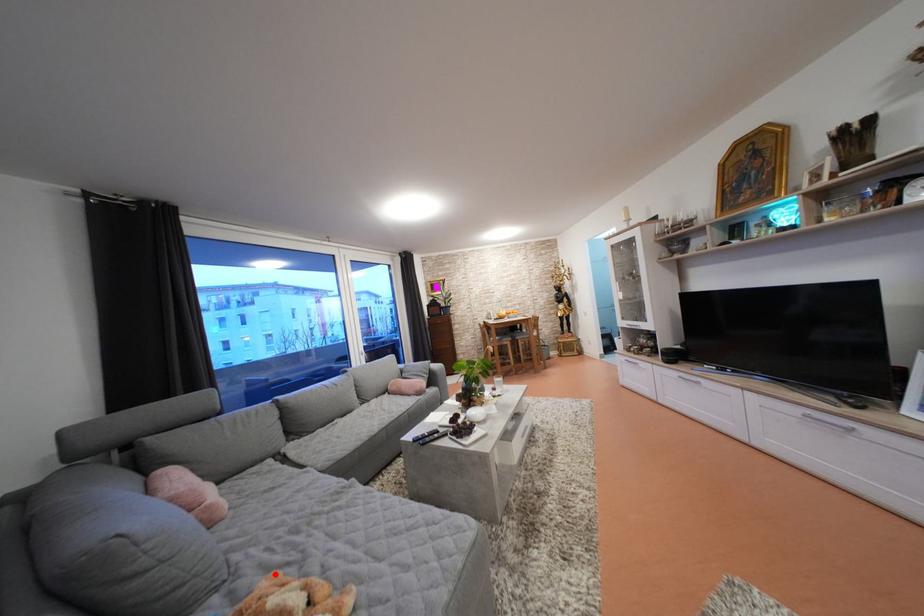
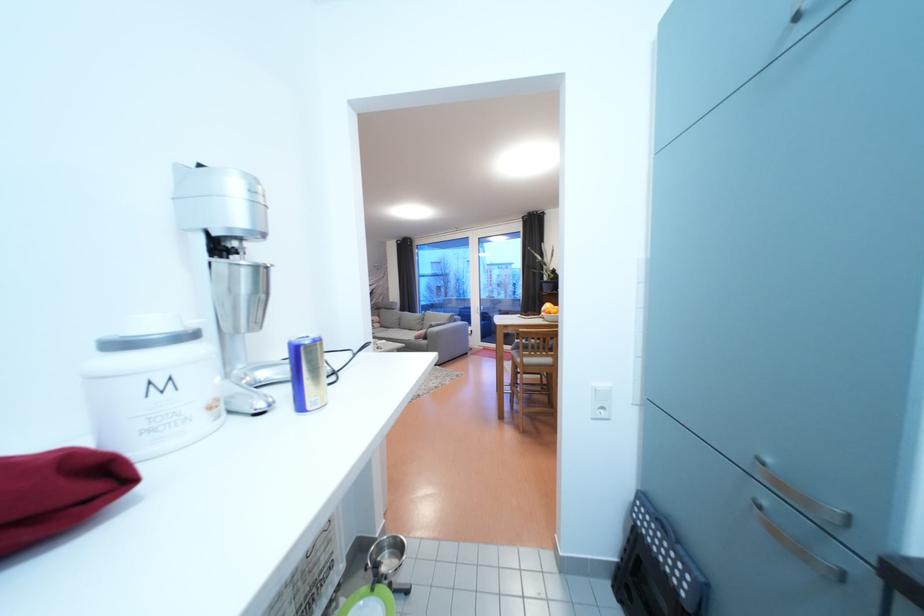
Question: I am providing you with two images of the same scene from different viewpoints. A red point is marked on the first image. At the location where the point appears in image 1, is it still visible in image 2?

Choices:
 (A) Yes
 (B) No

Answer: (B)